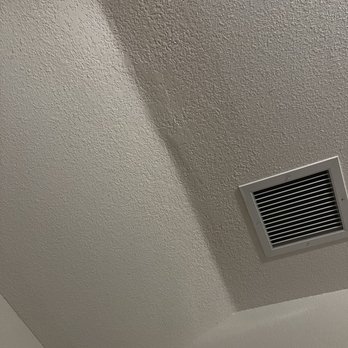
The height and width of the screenshot is (348, 348). I want to click on line where wall meets ceiling, so click(x=20, y=319).